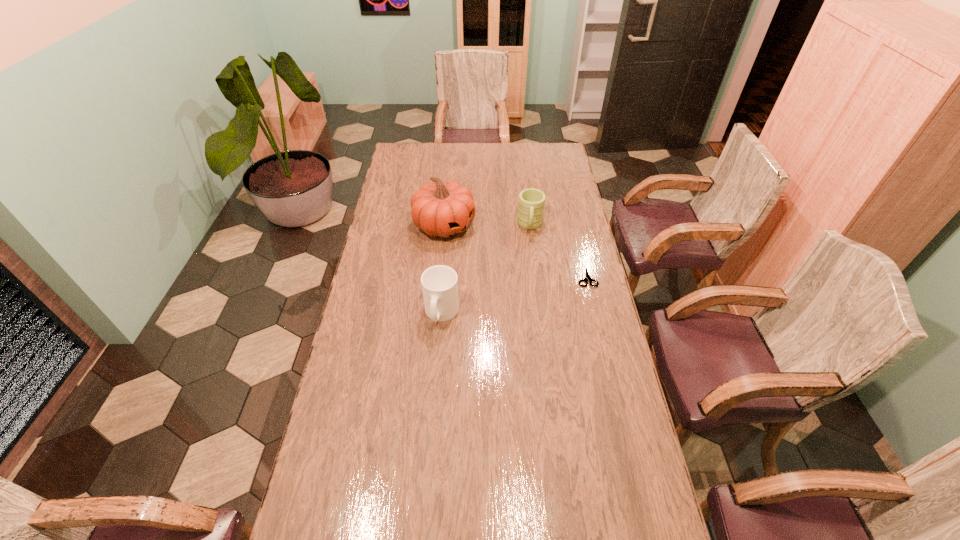
Where is `blank space located on the side of the right mug with the handle`? This screenshot has width=960, height=540. blank space located on the side of the right mug with the handle is located at coordinates (530, 254).

Where is `blank area located 0.140m on the side of the right mug with the handle`? blank area located 0.140m on the side of the right mug with the handle is located at coordinates (530, 260).

The width and height of the screenshot is (960, 540). What are the coordinates of `vacant space situated on the face of the pumpkin` in the screenshot? It's located at (507, 268).

Locate an element on the screen. blank space located 0.090m on the face of the pumpkin is located at coordinates (x=481, y=250).

Where is `vacant space located on the face of the pumpkin`? vacant space located on the face of the pumpkin is located at coordinates (534, 287).

Find the location of a particular element. The height and width of the screenshot is (540, 960). object positioned at the left edge is located at coordinates (443, 209).

Find the location of a particular element. The width and height of the screenshot is (960, 540). object that is at the right edge is located at coordinates (587, 277).

Identify the location of vacant space at the far edge of the desktop. This screenshot has height=540, width=960. (481, 165).

This screenshot has width=960, height=540. Identify the location of vacant region at the near edge of the desktop. (523, 509).

Identify the location of free region at the left edge of the desktop. This screenshot has width=960, height=540. (399, 296).